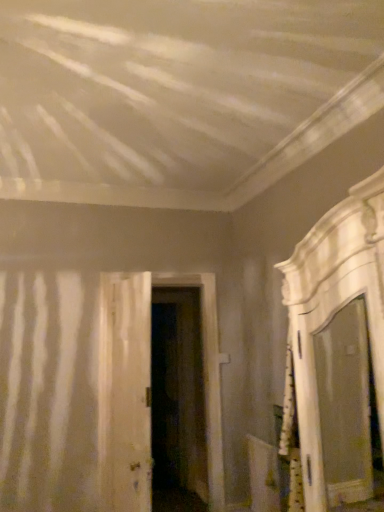
Question: Is point (122, 487) closer or farther from the camera than point (370, 336)?

Choices:
 (A) closer
 (B) farther

Answer: (A)

Question: Considering their positions, is white wood door at center, marked as the 1th door in a front-to-back arrangement, located in front of or behind white glossy mirror at right?

Choices:
 (A) behind
 (B) front

Answer: (A)

Question: Which object is the farthest from the white wood door at center, arranged as the third door when viewed from the back?

Choices:
 (A) white glossy mirror at right
 (B) white wood door at center, which is the second door from back to front
 (C) dark wood door at center, the third door from the front

Answer: (A)

Question: Estimate the real-world distances between objects in this image. Which object is closer to the white wood door at center, which is the second door from back to front?

Choices:
 (A) white wood door at center, marked as the 1th door in a front-to-back arrangement
 (B) white glossy mirror at right
 (C) dark wood door at center, the third door from the front

Answer: (A)